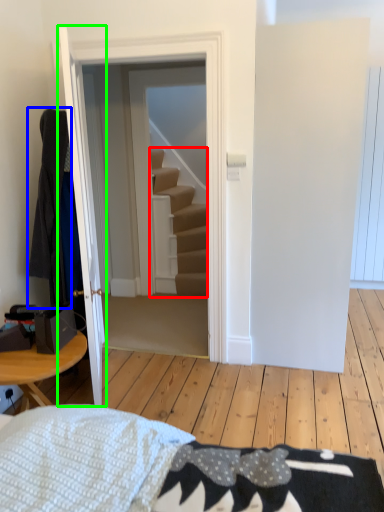
Question: Which object is the farthest from stairs (highlighted by a red box)? Choose among these: robe (highlighted by a blue box) or door (highlighted by a green box).

Choices:
 (A) robe
 (B) door

Answer: (B)